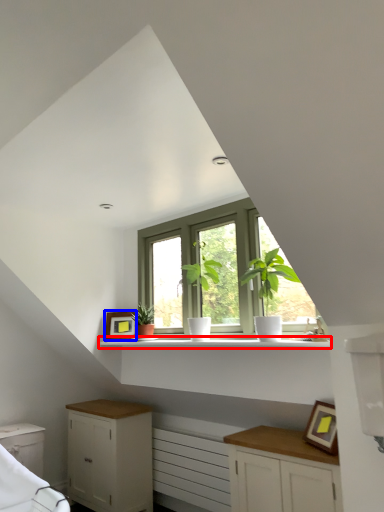
Question: Which point is closer to the camera, shelf (highlighted by a red box) or picture frame (highlighted by a blue box)?

Choices:
 (A) shelf
 (B) picture frame

Answer: (A)